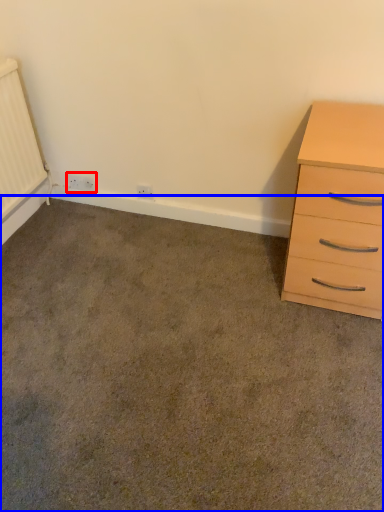
Question: Which point is further to the camera, electric outlet (highlighted by a red box) or concrete (highlighted by a blue box)?

Choices:
 (A) electric outlet
 (B) concrete

Answer: (A)